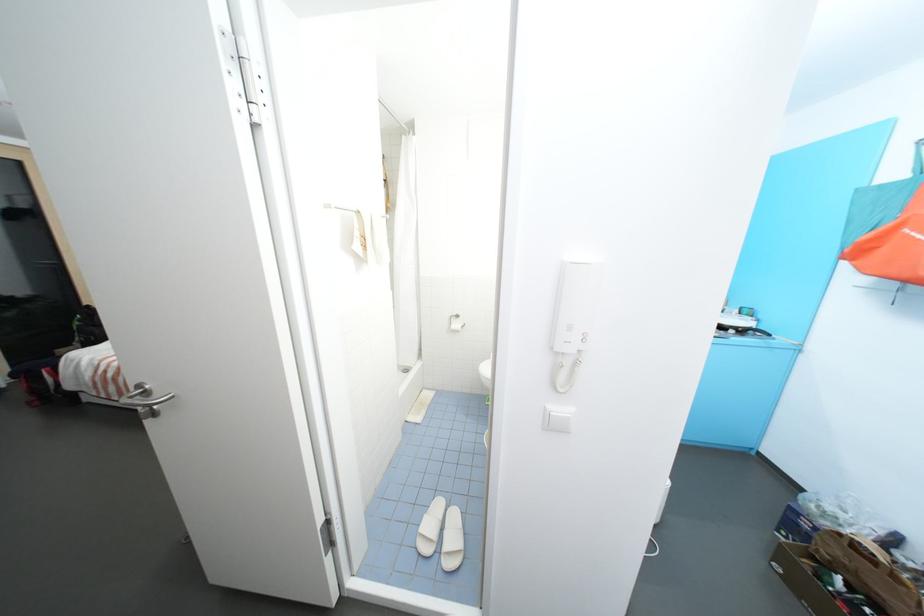
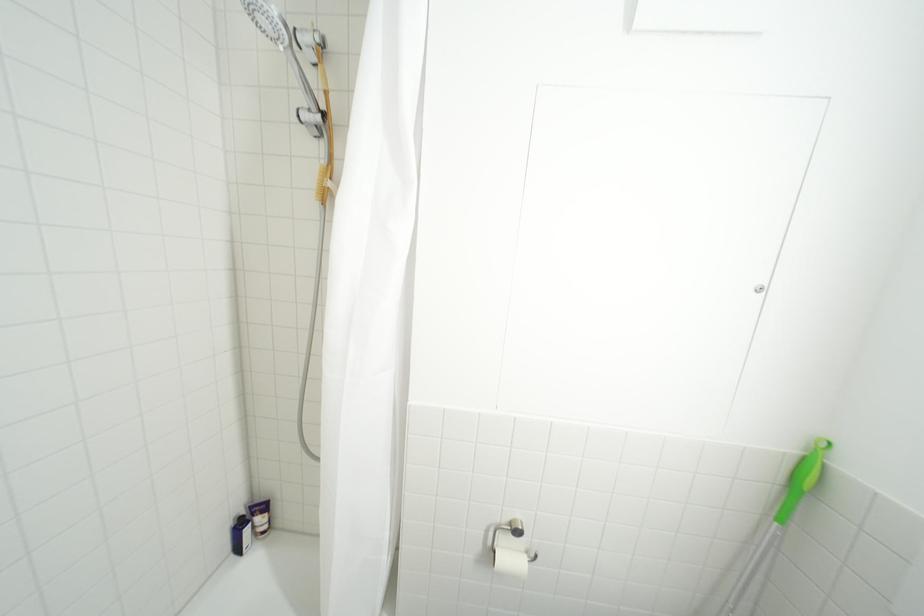
Question: In a continuous first-person perspective shot, in which direction is the camera moving?

Choices:
 (A) Left
 (B) Right
 (C) Forward
 (D) Backward

Answer: (C)